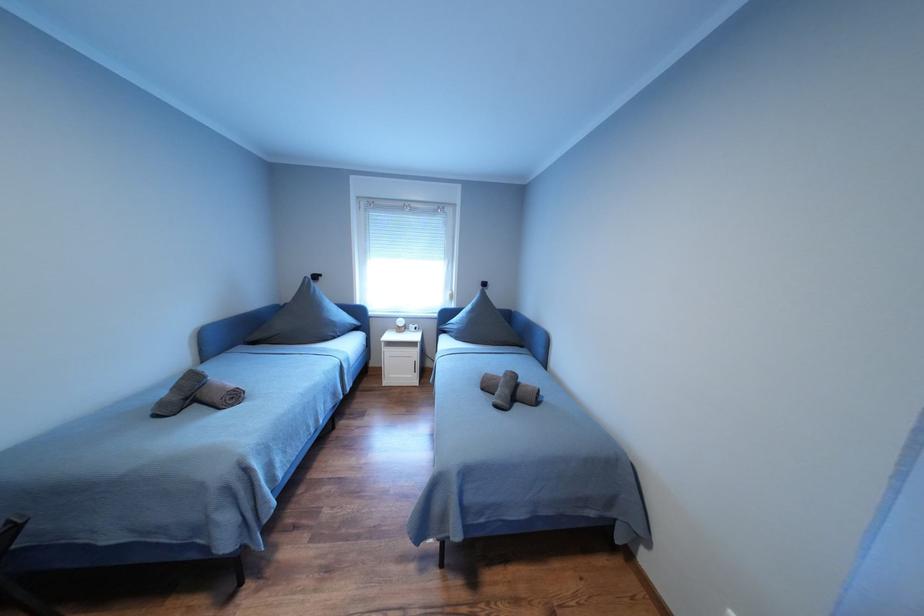
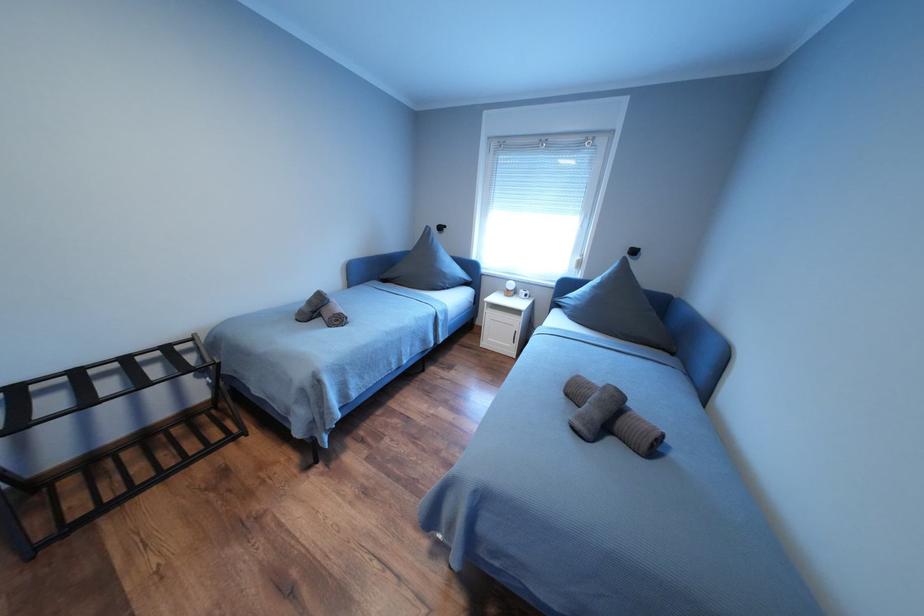
Question: How did the camera likely rotate?

Choices:
 (A) Left
 (B) Right
 (C) Up
 (D) Down

Answer: (A)